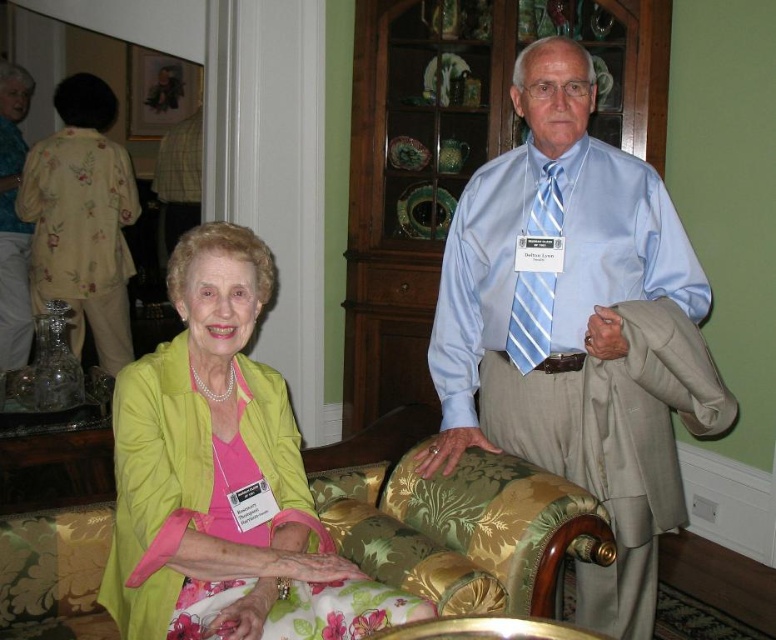
Question: Is light blue satin shirt at upper center to the right of green fabric dress at lower left from the viewer's perspective?

Choices:
 (A) yes
 (B) no

Answer: (A)

Question: Which point is farther to the camera?

Choices:
 (A) (535, 275)
 (B) (624, 429)
 (C) (172, 560)

Answer: (A)

Question: Which of the following is the farthest from the observer?

Choices:
 (A) (210, 429)
 (B) (402, 524)
 (C) (529, 305)

Answer: (C)

Question: Which object is farther from the camera taking this photo?

Choices:
 (A) light blue satin shirt at upper center
 (B) light blue striped tie at center

Answer: (B)

Question: Is light blue satin shirt at upper center smaller than light blue striped tie at center?

Choices:
 (A) no
 (B) yes

Answer: (A)

Question: Can you confirm if green fabric dress at lower left is positioned to the right of gold floral fabric couch at center?

Choices:
 (A) yes
 (B) no

Answer: (B)